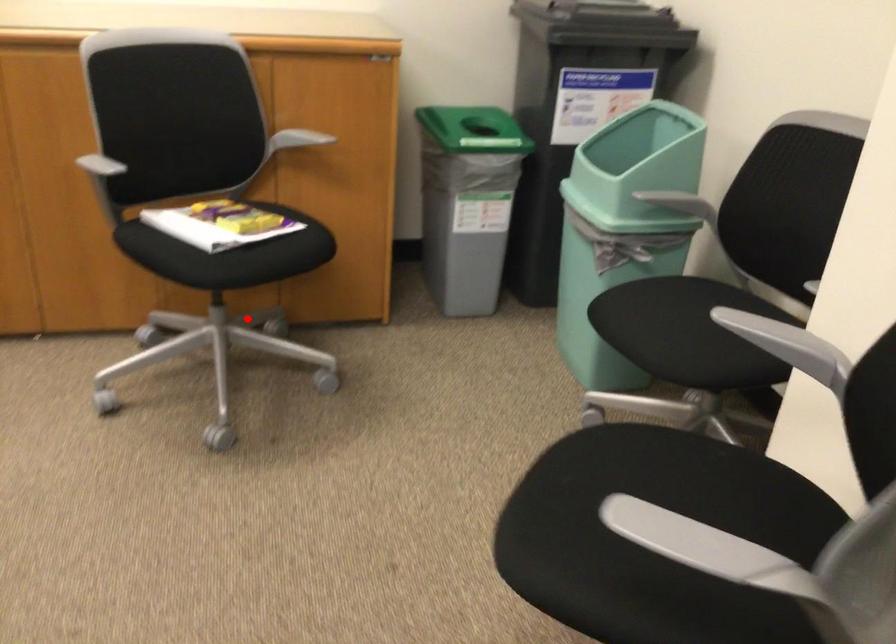
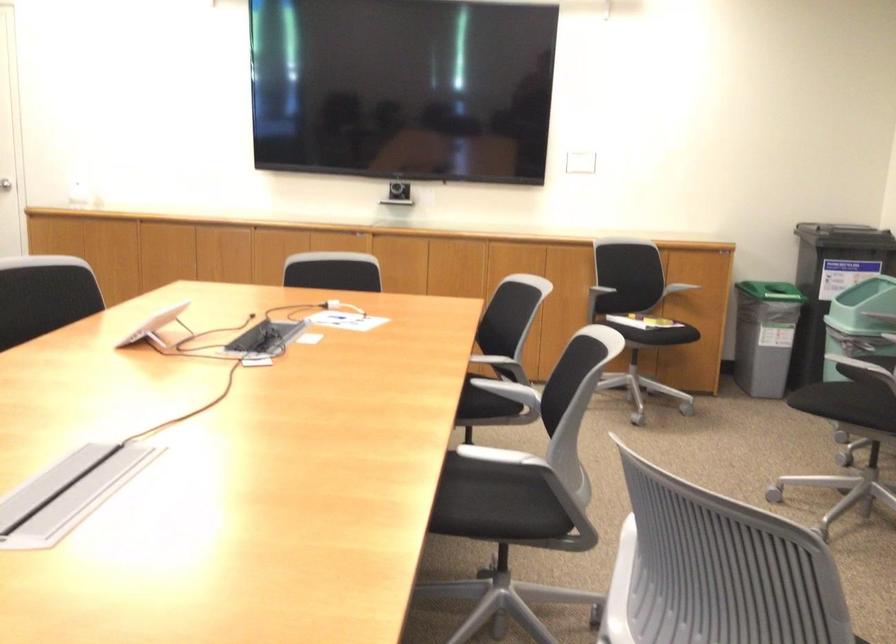
Question: I am providing you with two images of the same scene from different viewpoints. Image1 has a red point marked. In image2, the corresponding 3D location appears at what relative position? Reply with the corresponding letter.

Choices:
 (A) Closer
 (B) Farther

Answer: (B)